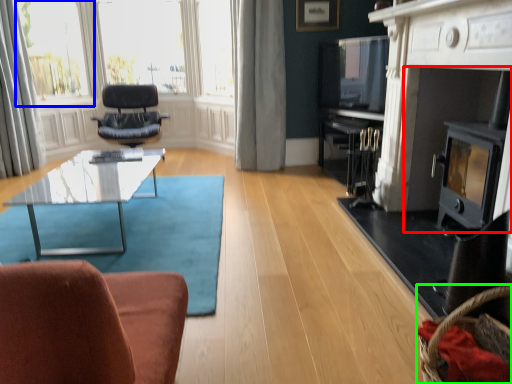
Question: Which object is positioned farthest from fireplace (highlighted by a red box)? Select from bay window (highlighted by a blue box) and basket (highlighted by a green box).

Choices:
 (A) bay window
 (B) basket

Answer: (A)